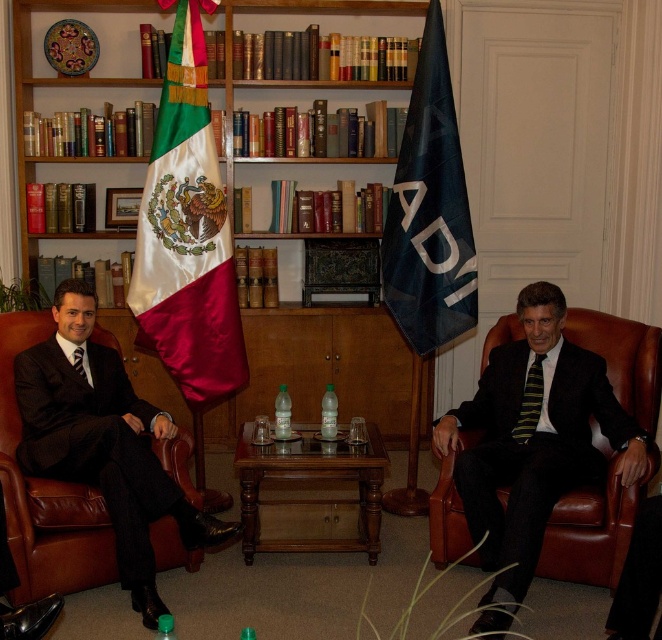
Question: Does dark brown leather suit at left have a larger size compared to blue fabric flag at center?

Choices:
 (A) no
 (B) yes

Answer: (B)

Question: Which object is positioned closest to the blue fabric flag at center?

Choices:
 (A) yellow-green striped tie at right
 (B) wooden bookshelf at upper center
 (C) dark brown leather suit at left

Answer: (A)

Question: Does satin silk flag at center appear over dark brown leather suit at left?

Choices:
 (A) no
 (B) yes

Answer: (B)

Question: Which point is closer to the camera taking this photo?

Choices:
 (A) (536, 406)
 (B) (428, 17)
 (C) (40, 81)
 (D) (156, 314)

Answer: (A)

Question: Estimate the real-world distances between objects in this image. Which object is farther from the black suit at center?

Choices:
 (A) satin silk flag at center
 (B) blue fabric flag at center
 (C) dark brown leather suit at left

Answer: (A)

Question: In this image, where is wooden bookshelf at upper center located relative to black suit at center?

Choices:
 (A) below
 (B) above

Answer: (B)